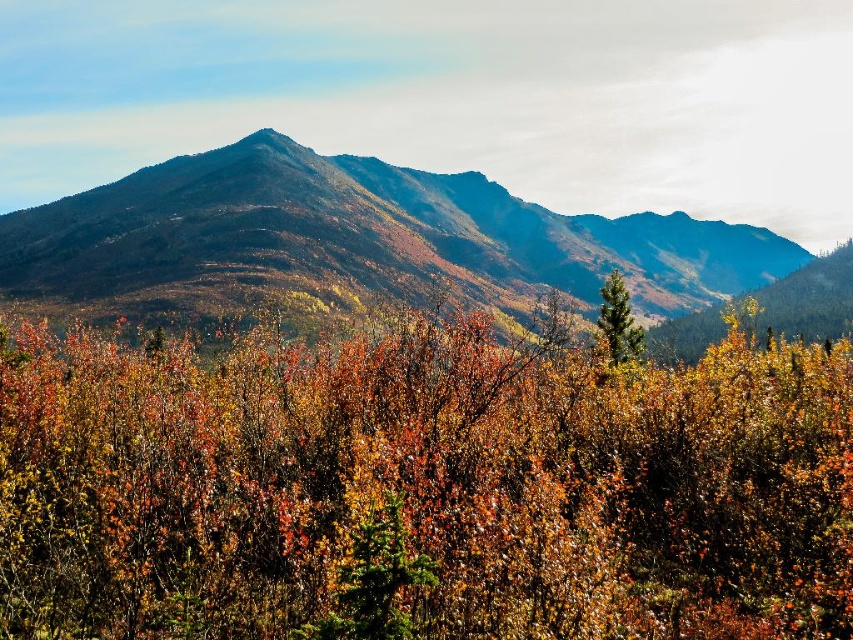
You are a hiker standing at the origin point of a coordinate system placed at the bottom left corner of the image. You want to take a photo of the multicolored foliage at center. In which direction should you move to reach the foliage?

The multicolored foliage at center is located at point (421, 488), so you should move northeast to reach it.

You are an environmental scientist assessing the landscape. You need to determine which object occupies a greater area in the scene between the smooth brown mountain range at center and the green matte tree at center. Based on the scene description, which one is larger?

The smooth brown mountain range at center is larger in size than the green matte tree at center, so the mountain range occupies a greater area in the scene.

You are a hiker trying to locate the smooth brown mountain range at center in the landscape. Based on the coordinates provided, where exactly should you look to find it?

The smooth brown mountain range at center is located at coordinates point (375, 234).